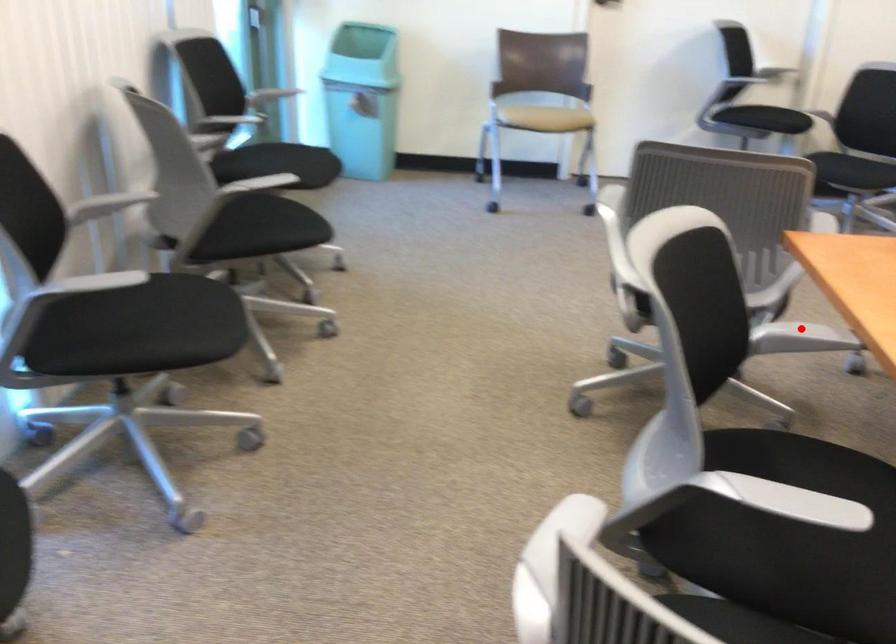
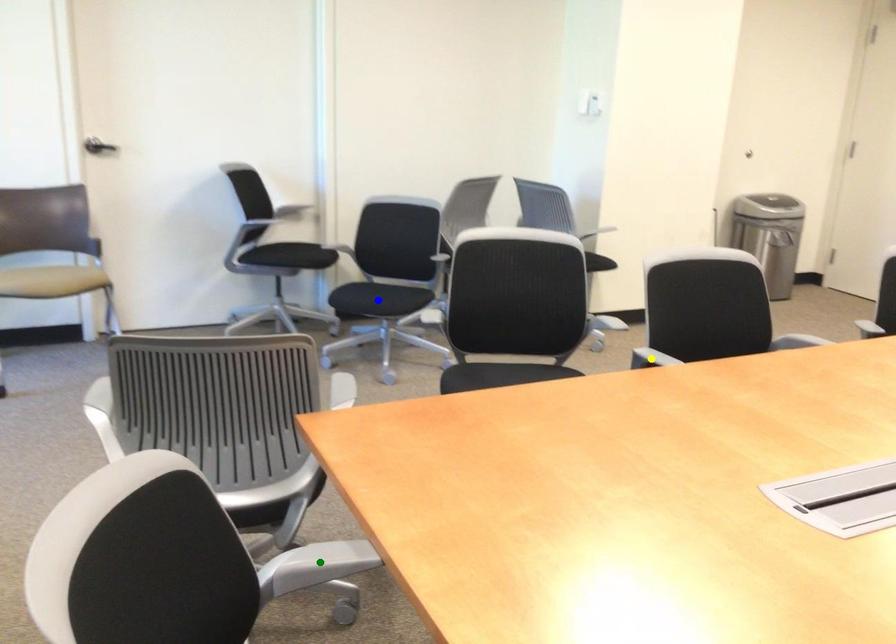
Question: I am providing you with two images of the same scene from different viewpoints. A red point is marked on the first image. You are given multiple points on the second image. Which spot in image 2 lines up with the point in image 1?

Choices:
 (A) green point
 (B) blue point
 (C) yellow point

Answer: (A)